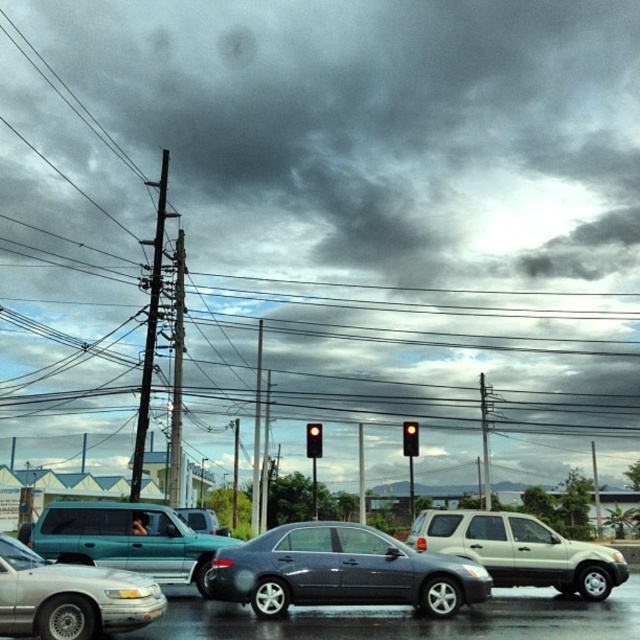
You are a delivery driver needing to stop your truck 20 meters away from the yellow glass traffic light at center. Can you safely stop your truck before reaching the teal matte suv at center?

The teal matte suv at center is 18.85 meters away from the yellow glass traffic light at center. Since the required stopping distance is 20 meters, you cannot safely stop your truck before reaching the teal matte suv at center because the distance is shorter than the required stopping distance.

You are a weather observer standing on the sidewalk. You notice the dark gray cloud at upper center and the metallic silver sedan at lower left. Which object is higher in the sky?

The dark gray cloud at upper center is higher in the sky than the metallic silver sedan at lower left because it has a greater height compared to it.

From the picture: You are a pedestrian standing on the sidewalk and see the dark gray cloud at upper center and the metallic gray utility pole at left. Which object is positioned to the right side of the other?

The dark gray cloud at upper center is positioned to the right of the metallic gray utility pole at left.